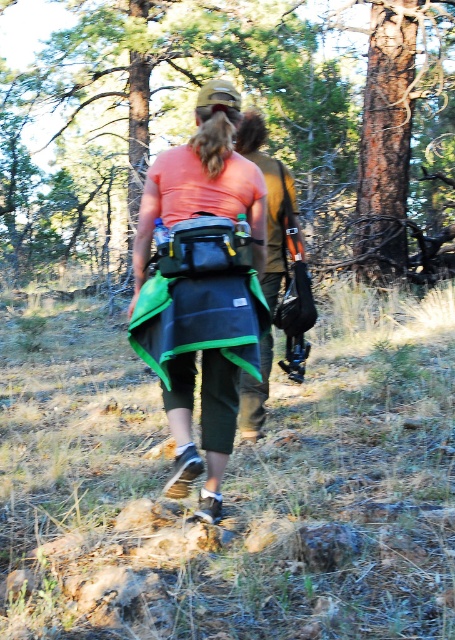
Can you confirm if matte green backpack at center is bigger than brown leather jacket at center?

Incorrect, matte green backpack at center is not larger than brown leather jacket at center.

Does point (225, 234) come in front of point (242, 432)?

Yes, it is in front of point (242, 432).

Locate an element on the screen. The width and height of the screenshot is (455, 640). matte green backpack at center is located at coordinates (202, 285).